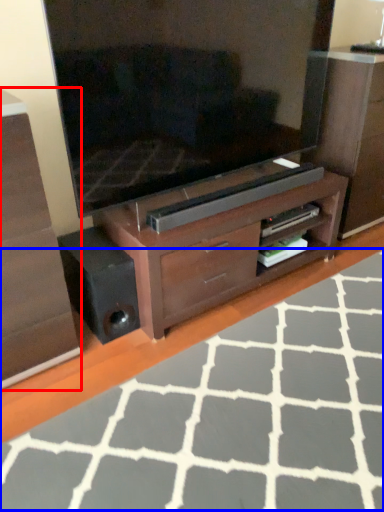
Question: Which object is further to the camera taking this photo, chest of drawers (highlighted by a red box) or plain (highlighted by a blue box)?

Choices:
 (A) chest of drawers
 (B) plain

Answer: (A)